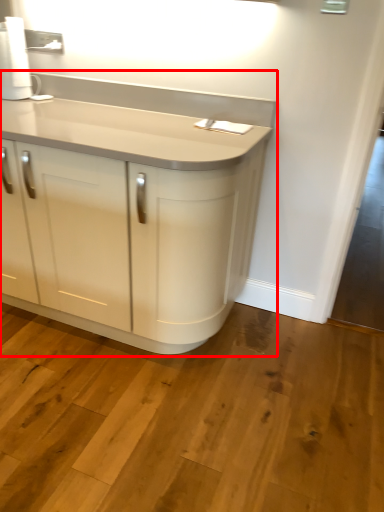
Question: From the image's perspective, where is cupboard (annotated by the red box) located relative to paper towel?

Choices:
 (A) above
 (B) below

Answer: (B)